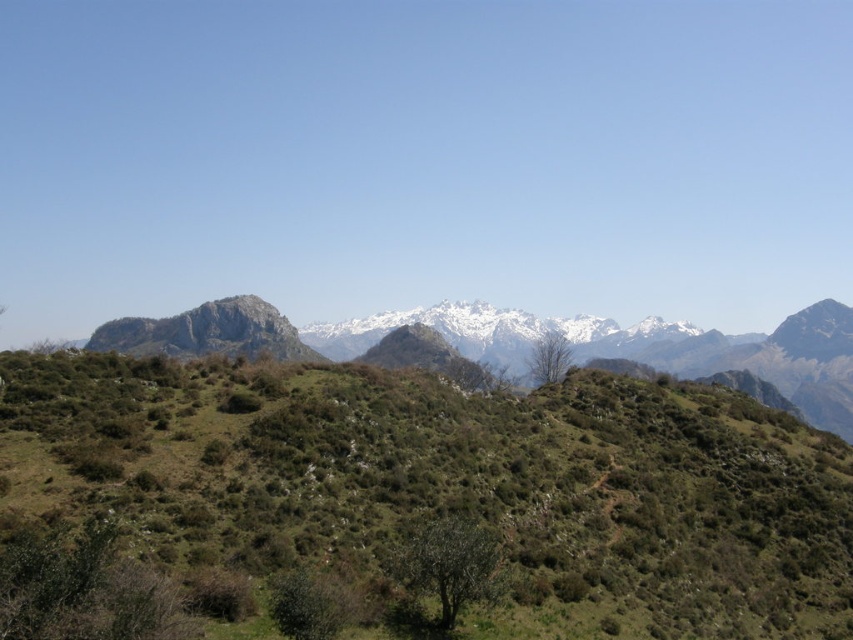
Question: Can you confirm if rugged stone mountain range at center is positioned below bare branches at center?

Choices:
 (A) yes
 (B) no

Answer: (B)

Question: Does green grassy hill at center appear on the left side of rugged stone mountain range at center?

Choices:
 (A) yes
 (B) no

Answer: (A)

Question: Which object is the farthest from the green leafy tree at center?

Choices:
 (A) green grassy hill at center
 (B) bare branches at center
 (C) rugged stone mountain range at center

Answer: (C)

Question: Which point is closer to the camera?

Choices:
 (A) (648, 356)
 (B) (264, 365)

Answer: (B)

Question: Does green grassy hill at center have a larger size compared to rugged stone mountain range at center?

Choices:
 (A) yes
 (B) no

Answer: (B)

Question: Which point appears closest to the camera in this image?

Choices:
 (A) (405, 456)
 (B) (564, 355)

Answer: (A)